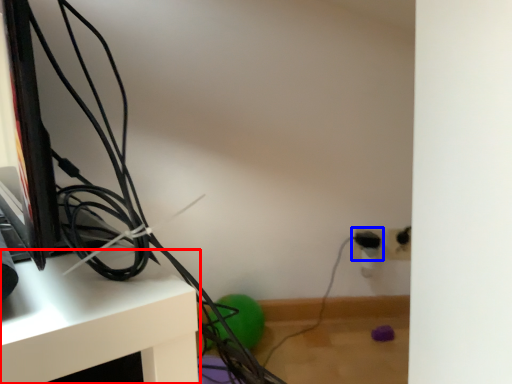
Question: Which of the following is the closest to the observer, furniture (highlighted by a red box) or electric outlet (highlighted by a blue box)?

Choices:
 (A) furniture
 (B) electric outlet

Answer: (A)